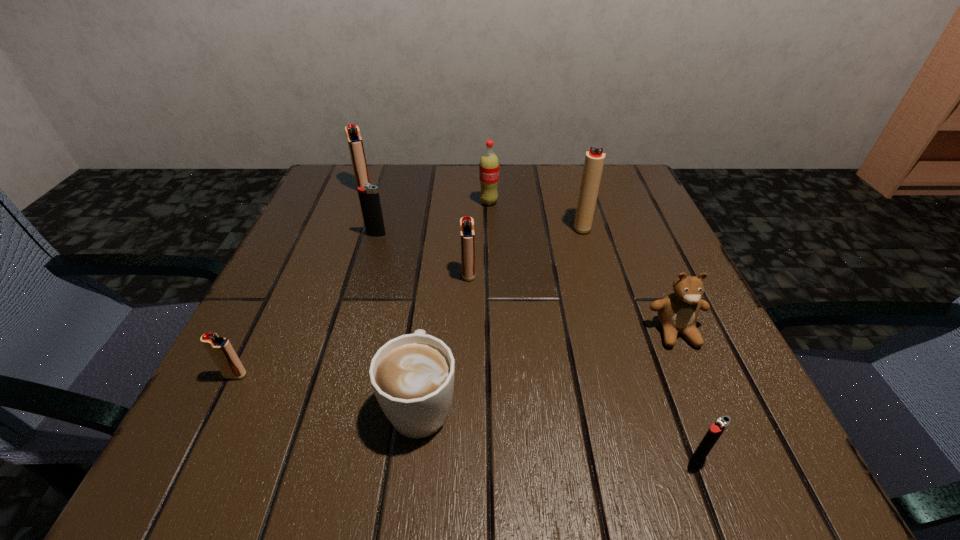
Identify the location of vacant point located on the left of the third red igniter from left to right. The height and width of the screenshot is (540, 960). (323, 274).

The width and height of the screenshot is (960, 540). Identify the location of vacant space located 0.080m on the front-facing side of the teddy bear. (703, 395).

Find the location of a particular element. Image resolution: width=960 pixels, height=540 pixels. free point located with the handle on the side of the cappuccino is located at coordinates (433, 294).

Find the location of a particular element. The width and height of the screenshot is (960, 540). vacant space located with the handle on the side of the cappuccino is located at coordinates (431, 315).

I want to click on vacant space located 0.380m with the handle on the side of the cappuccino, so click(x=442, y=220).

Find the location of a particular element. This screenshot has height=540, width=960. vacant space located 0.140m on the front of the second nearest igniter is located at coordinates (186, 476).

In order to click on free point located 0.100m on the right of the nearest igniter in this screenshot , I will do `click(787, 459)`.

Identify the location of soda located in the far edge section of the desktop. (489, 164).

The width and height of the screenshot is (960, 540). Find the location of `cappuccino that is positioned at the near edge`. cappuccino that is positioned at the near edge is located at coordinates (412, 376).

The height and width of the screenshot is (540, 960). Find the location of `igniter that is at the near edge`. igniter that is at the near edge is located at coordinates (715, 431).